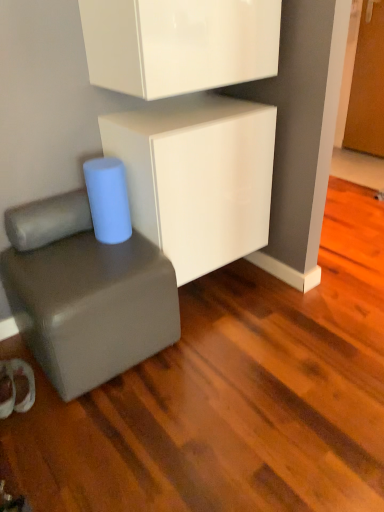
Locate an element on the screen. free location in front of matte gray cube at lower left is located at coordinates (111, 439).